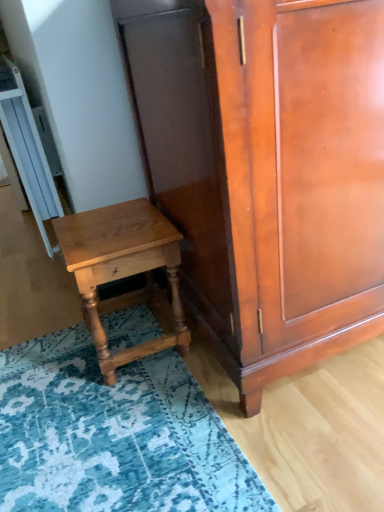
Image resolution: width=384 pixels, height=512 pixels. In order to click on free space in front of light brown wood nightstand at lower left in this screenshot , I will do `click(135, 413)`.